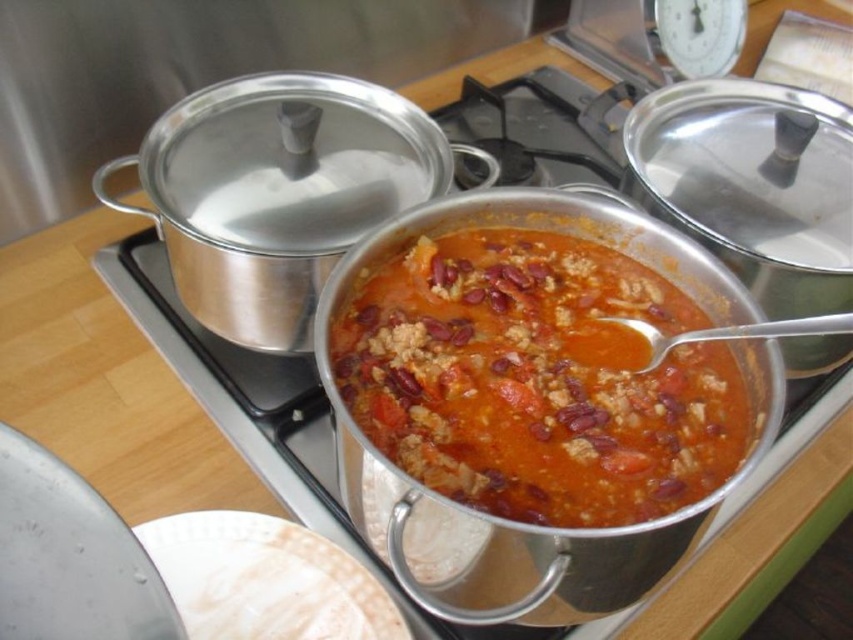
You are setting the table for dinner and see the silver metallic spoon at center and the white matte plate at lower left. Which object is closer to you?

The white matte plate at lower left is closer to you because the silver metallic spoon at center is behind it.

You are setting the table for a meal and have a white matte plate at lower left and a silver metallic spoon at center. Which item is smaller in width?

The white matte plate at lower left has a lesser width compared to the silver metallic spoon at center, so the white matte plate at lower left is smaller in width.